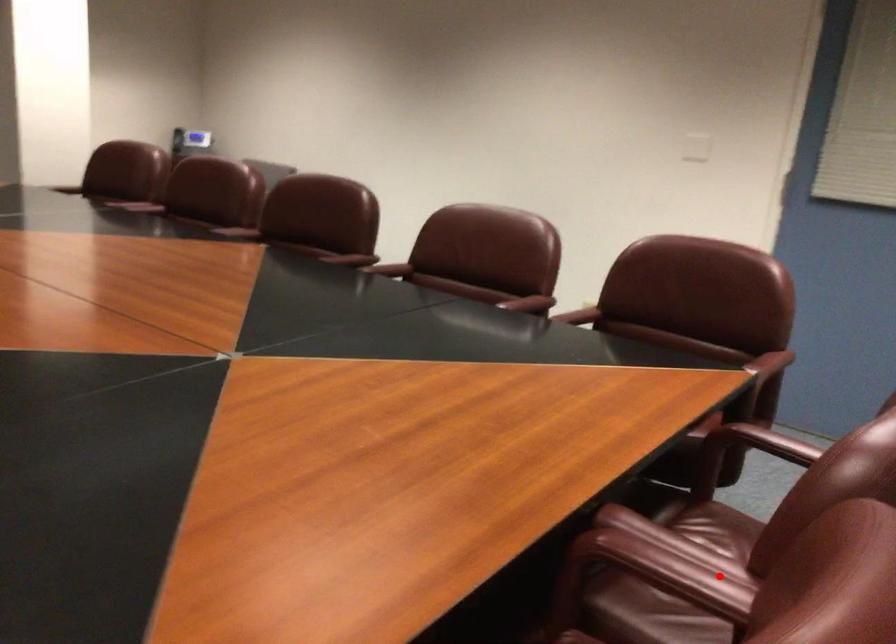
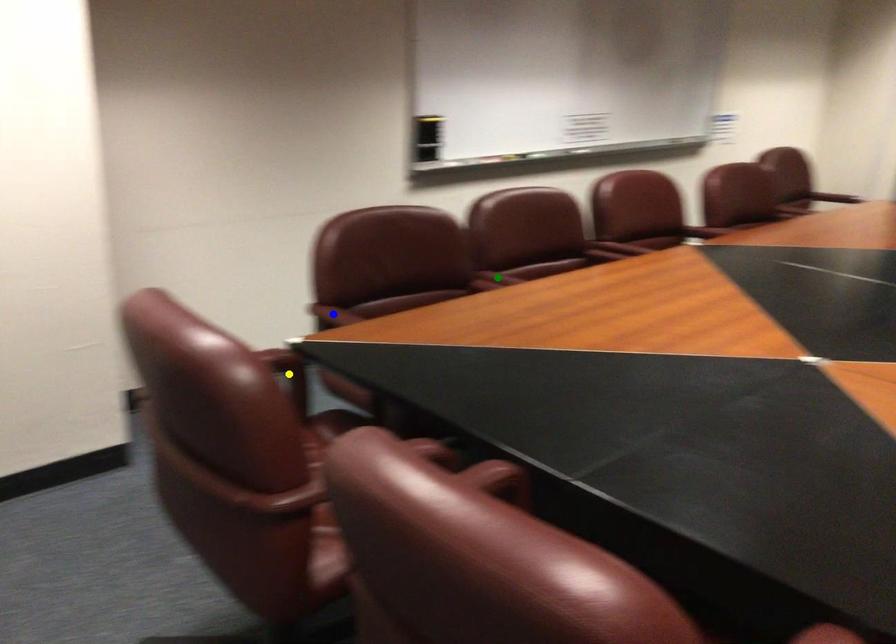
Question: I am providing you with two images of the same scene from different viewpoints. A red point is marked on the first image. You are given multiple points on the second image. Which mark in image 2 goes with the point in image 1?

Choices:
 (A) yellow point
 (B) green point
 (C) blue point

Answer: (B)